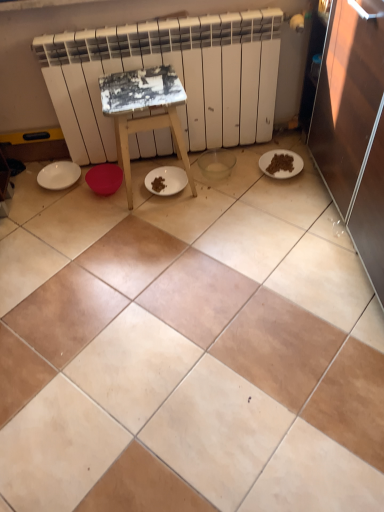
The image size is (384, 512). Find the location of `free location in front of white matte plate at left, the 2th paper plate viewed from the right`. free location in front of white matte plate at left, the 2th paper plate viewed from the right is located at coordinates (54, 209).